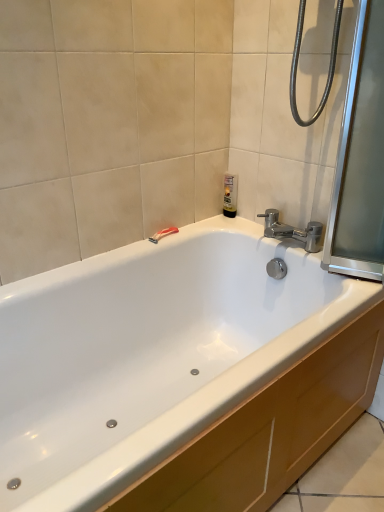
Question: Does polished chrome faucet at upper right come in front of translucent plastic bottle at upper center?

Choices:
 (A) no
 (B) yes

Answer: (B)

Question: Is polished chrome faucet at upper right not close to translucent plastic bottle at upper center?

Choices:
 (A) no
 (B) yes

Answer: (A)

Question: Is polished chrome faucet at upper right taller than translucent plastic bottle at upper center?

Choices:
 (A) no
 (B) yes

Answer: (A)

Question: Does polished chrome faucet at upper right appear on the right side of translucent plastic bottle at upper center?

Choices:
 (A) no
 (B) yes

Answer: (B)

Question: From a real-world perspective, is polished chrome faucet at upper right under translucent plastic bottle at upper center?

Choices:
 (A) no
 (B) yes

Answer: (B)

Question: From the image's perspective, would you say polished chrome faucet at upper right is positioned over translucent plastic bottle at upper center?

Choices:
 (A) yes
 (B) no

Answer: (B)

Question: Is transparent glass screen door at right bigger than polished chrome faucet at upper right?

Choices:
 (A) no
 (B) yes

Answer: (B)

Question: Is transparent glass screen door at right oriented towards polished chrome faucet at upper right?

Choices:
 (A) yes
 (B) no

Answer: (B)

Question: Does transparent glass screen door at right appear on the left side of polished chrome faucet at upper right?

Choices:
 (A) no
 (B) yes

Answer: (A)

Question: Does transparent glass screen door at right contain polished chrome faucet at upper right?

Choices:
 (A) yes
 (B) no

Answer: (B)

Question: Can you confirm if transparent glass screen door at right is shorter than polished chrome faucet at upper right?

Choices:
 (A) no
 (B) yes

Answer: (A)

Question: From a real-world perspective, is transparent glass screen door at right physically above polished chrome faucet at upper right?

Choices:
 (A) yes
 (B) no

Answer: (A)

Question: Does transparent glass screen door at right have a smaller size compared to translucent plastic bottle at upper center?

Choices:
 (A) yes
 (B) no

Answer: (B)